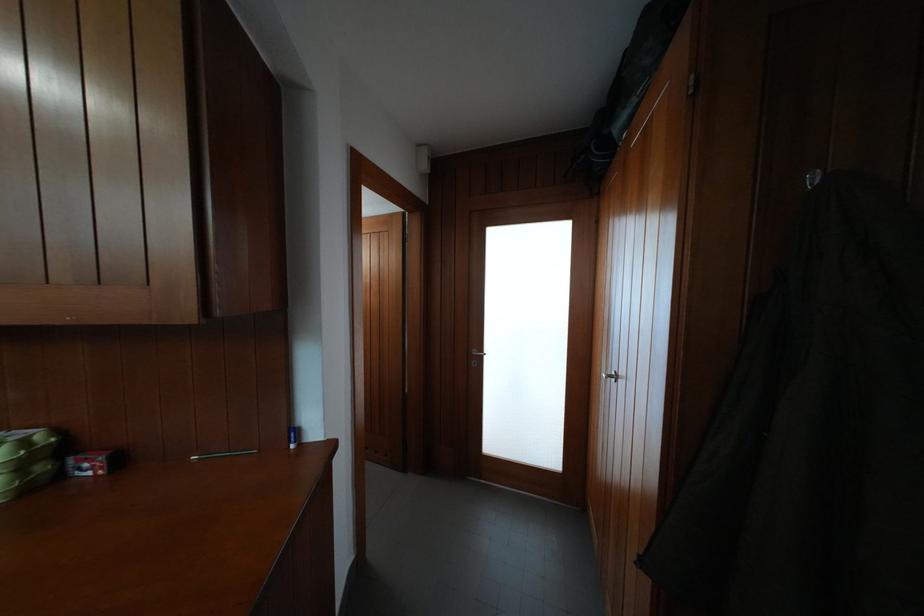
Which object does [293,437] point to?

It corresponds to the blue glue stick in the image.